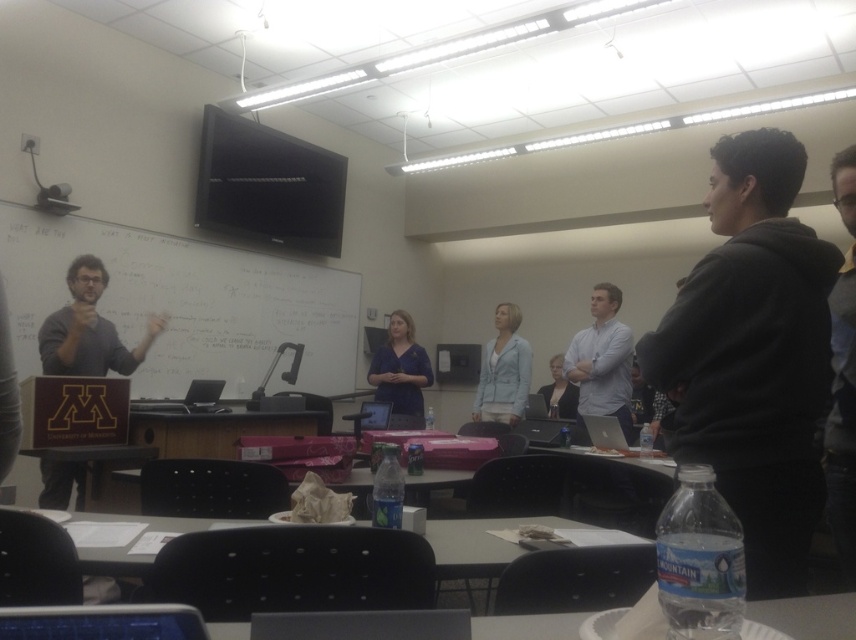
You are a student who needs to reach the clear plastic table at lower center from where you are standing next to the dark gray sweater at left. Can you walk directly to it without moving any objects?

The dark gray sweater at left and clear plastic table at lower center are 6.72 feet apart, so yes, you can walk directly to the clear plastic table at lower center without needing to move any objects since the distance is sufficient for movement.

You are a student sitting at the desk with the Mountain Dew bottle. You need to write something on the whiteboard at upper center. Can you reach it from your current position without moving your chair?

Answer: The whiteboard at upper center is located at point (185, 304), which is likely within reach if you can extend your arm or move slightly forward in your chair. However, since the question specifies not moving the chair, it depends on your arm length and the distance from your desk to the whiteboard. Without specific measurements, it is uncertain, but the coordinates suggest it might be reachable.

You are a student trying to determine if your backpack can fit between the dark gray sweater at left and the clear plastic table at lower center. The backpack is 30 cm wide. Can you fit it there?

The dark gray sweater at left has a lesser width compared to clear plastic table at lower center. Since the backpack is 30 cm wide, and the space between them is determined by the width of the sweater, which is narrower than the table, it might be possible. However, without knowing the exact distance between them, it is hard to confirm.